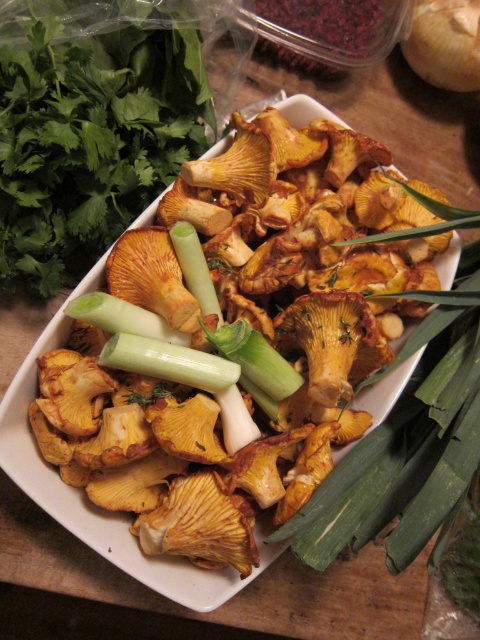
Question: Is yellowish-brown textured mushrooms at center below green smooth/leathery scallion at center?

Choices:
 (A) no
 (B) yes

Answer: (B)

Question: Is yellowish-brown textured mushrooms at center positioned at the back of green smooth/leathery scallion at center?

Choices:
 (A) yes
 (B) no

Answer: (B)

Question: Does yellowish-brown textured mushrooms at center appear over green smooth/leathery scallion at center?

Choices:
 (A) no
 (B) yes

Answer: (A)

Question: Which of the following is the closest to the observer?

Choices:
 (A) (23, 285)
 (B) (323, 328)

Answer: (B)

Question: Among these objects, which one is nearest to the camera?

Choices:
 (A) green smooth/leathery scallion at center
 (B) yellowish-brown textured mushrooms at center

Answer: (B)